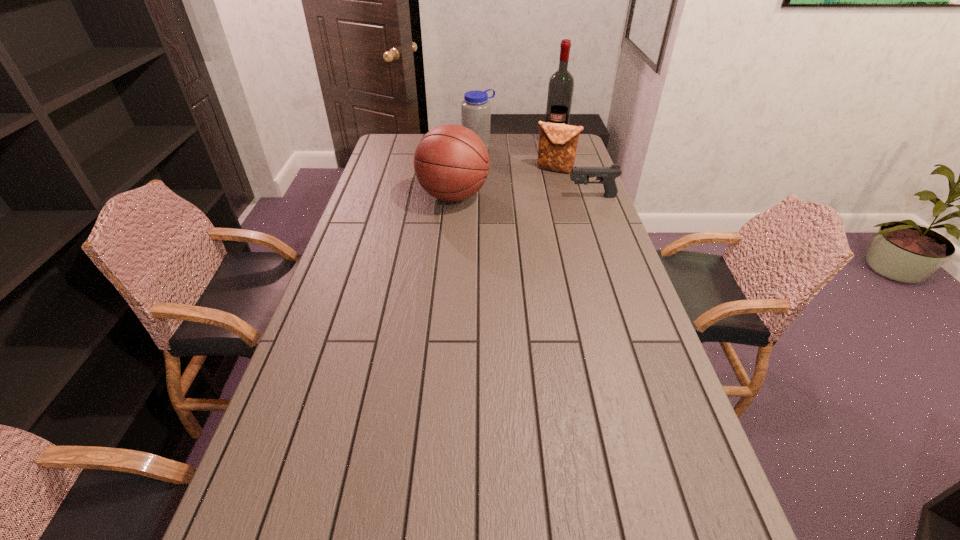
This screenshot has width=960, height=540. What are the coordinates of `water bottle that is at the far edge` in the screenshot? It's located at (475, 109).

This screenshot has width=960, height=540. I want to click on pistol that is at the right edge, so click(607, 175).

Where is `clutch bag at the right edge`? clutch bag at the right edge is located at coordinates (557, 148).

You are a GUI agent. You are given a task and a screenshot of the screen. Output one action in this format:
    pyautogui.click(x=<x>, y=<y>)
    Task: Click on the alcohol that is positioned at the right edge
    
    Given the screenshot: What is the action you would take?
    pyautogui.click(x=561, y=84)

Where is `object positioned at the far right corner`? object positioned at the far right corner is located at coordinates (561, 84).

Find the location of a particular element. This screenshot has height=540, width=960. vacant area at the near edge of the desktop is located at coordinates (592, 500).

This screenshot has width=960, height=540. Find the location of `free region at the left edge of the desktop`. free region at the left edge of the desktop is located at coordinates (376, 295).

This screenshot has height=540, width=960. In the image, there is a desktop. In order to click on blank space at the right edge in this screenshot , I will do `click(639, 397)`.

Image resolution: width=960 pixels, height=540 pixels. In the image, there is a desktop. Find the location of `blank space at the near left corner`. blank space at the near left corner is located at coordinates (263, 474).

You are a GUI agent. You are given a task and a screenshot of the screen. Output one action in this format:
    pyautogui.click(x=<x>, y=<y>)
    Task: Click on the free space that is in between the basketball and the pistol
    
    Given the screenshot: What is the action you would take?
    pyautogui.click(x=522, y=197)